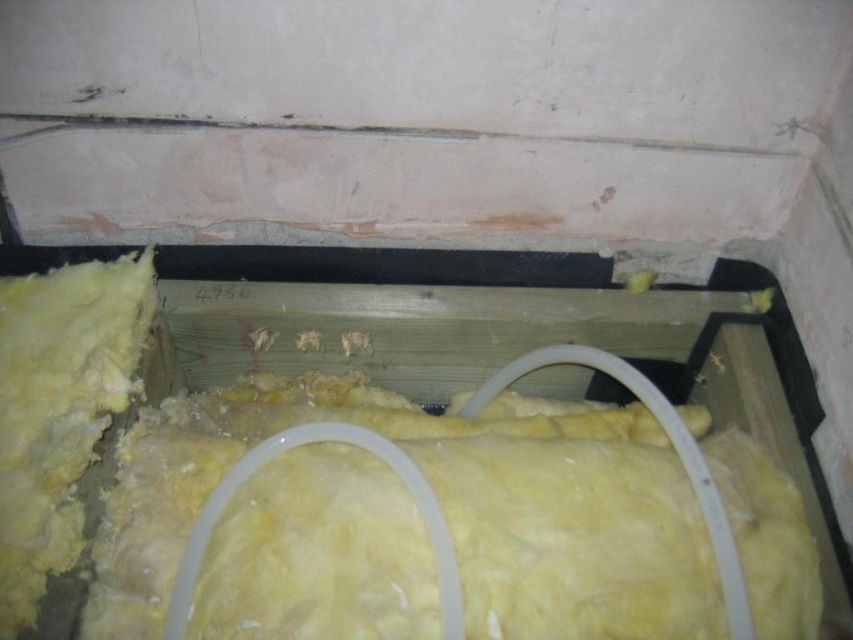
Question: Does yellow fiberglass insulation at center appear over yellow wool insulation at left?

Choices:
 (A) no
 (B) yes

Answer: (A)

Question: Is yellow fiberglass insulation at center bigger than yellow wool insulation at left?

Choices:
 (A) no
 (B) yes

Answer: (B)

Question: Among these objects, which one is farthest from the camera?

Choices:
 (A) yellow fiberglass insulation at center
 (B) yellow wool insulation at left

Answer: (B)

Question: Is yellow fiberglass insulation at center positioned in front of yellow wool insulation at left?

Choices:
 (A) yes
 (B) no

Answer: (A)

Question: Which of the following is the closest to the observer?

Choices:
 (A) (200, 458)
 (B) (32, 445)

Answer: (B)

Question: Which of the following is the farthest from the observer?

Choices:
 (A) (297, 614)
 (B) (9, 352)

Answer: (B)